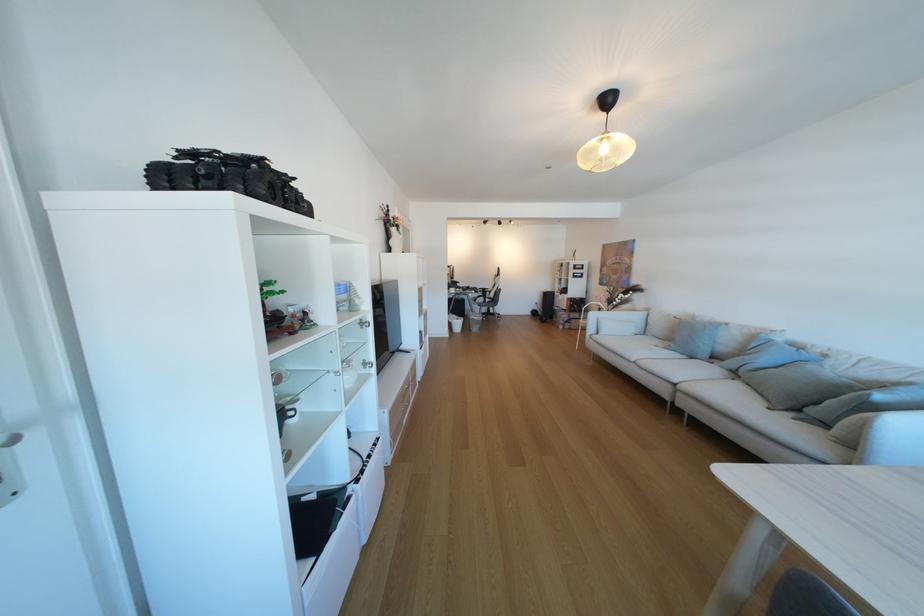
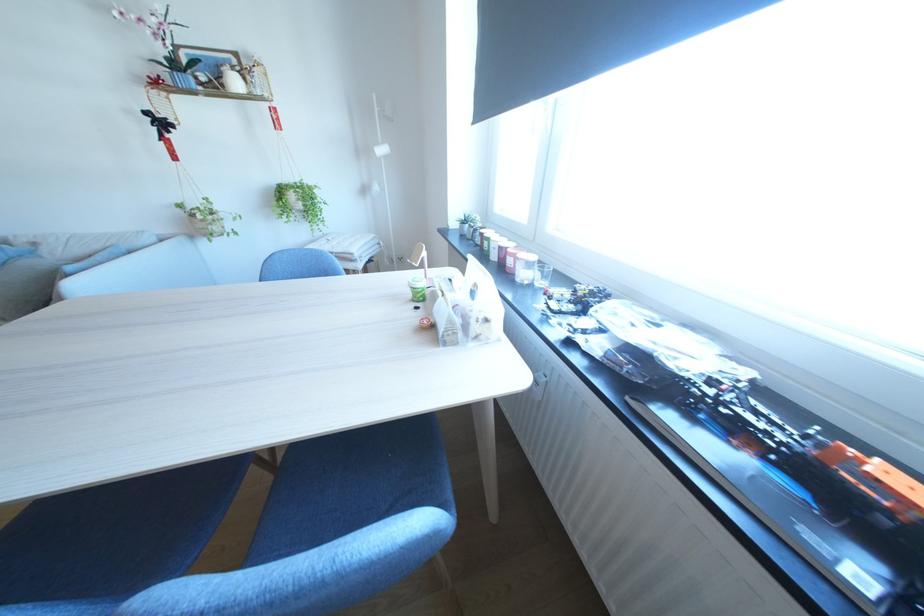
Based on the continuous images, in which direction is the camera rotating?

The camera rotated toward right-down.